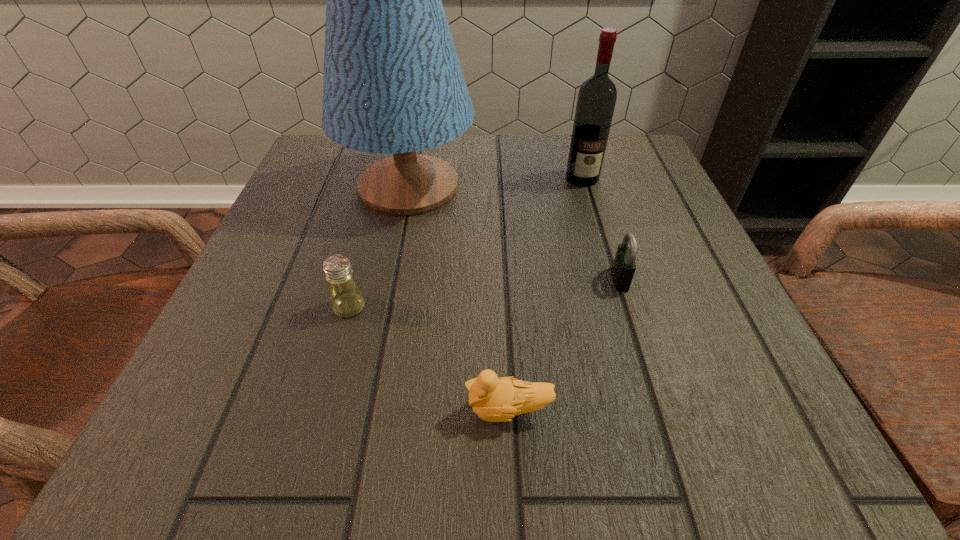
Locate an element on the screen. This screenshot has width=960, height=540. vacant space situated on the face of the nearest object is located at coordinates (174, 410).

In order to click on vacant area situated on the face of the nearest object in this screenshot , I will do `click(369, 410)`.

The image size is (960, 540). I want to click on lampshade present at the far edge, so click(x=393, y=84).

Where is `alcohol positioned at the far edge`? The height and width of the screenshot is (540, 960). alcohol positioned at the far edge is located at coordinates (597, 96).

Where is `object situated at the near edge`? This screenshot has width=960, height=540. object situated at the near edge is located at coordinates (493, 399).

Locate an element on the screen. Image resolution: width=960 pixels, height=540 pixels. lampshade located in the left edge section of the desktop is located at coordinates pyautogui.click(x=393, y=84).

Find the location of `saltshaker located at the left edge`. saltshaker located at the left edge is located at coordinates (346, 298).

Find the location of a particular element. This screenshot has height=540, width=960. alcohol that is positioned at the right edge is located at coordinates (x=597, y=96).

Find the location of a particular element. padlock that is at the right edge is located at coordinates (623, 269).

Where is `object situated at the far left corner`? The width and height of the screenshot is (960, 540). object situated at the far left corner is located at coordinates (393, 84).